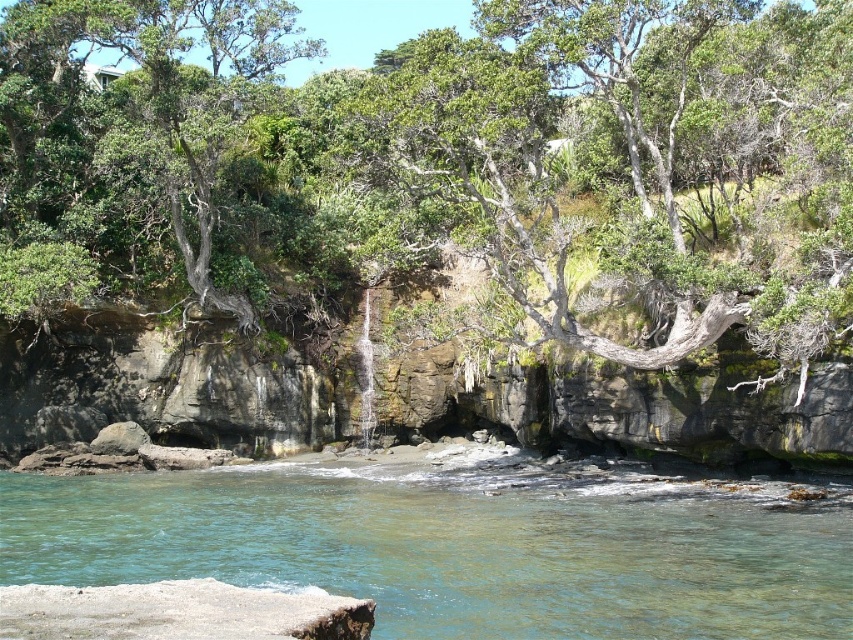
You are standing at the edge of the cliff overlooking the coastal scene. You notice a green leafy tree at center and clear water at lower center. Which object would appear closer to you in terms of size when viewed from your vantage point?

The green leafy tree at center appears larger in size compared to the clear water at lower center, so it would look closer to you when viewed from the cliff edge.

You are standing at the edge of the cliff in the coastal scene. You see a point marked at coordinates [469,157]. What object is located at that point?

The point at coordinates [469,157] corresponds to the green leafy tree at center.

You are standing at the edge of the cliff looking down at the clear water at lower center and the green leafy tree at center. Which object is positioned to the right when viewed from your perspective?

The green leafy tree at center is to the right of the clear water at lower center when viewed from the cliff edge.